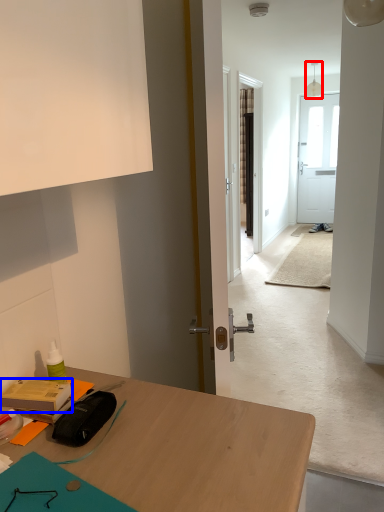
Question: Which point is closer to the camera, lamp (highlighted by a red box) or stationery (highlighted by a blue box)?

Choices:
 (A) lamp
 (B) stationery

Answer: (B)